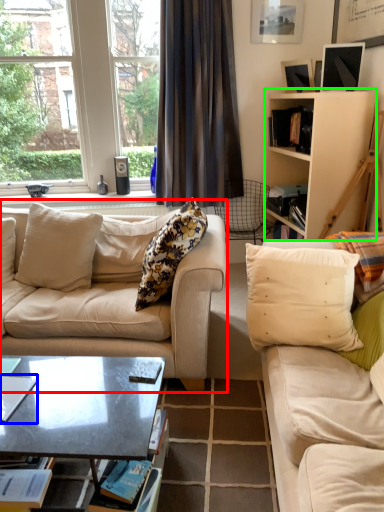
Question: Which object is positioned closest to studio couch (highlighted by a red box)? Select from magazine (highlighted by a blue box) and cabinetry (highlighted by a green box).

Choices:
 (A) magazine
 (B) cabinetry

Answer: (A)